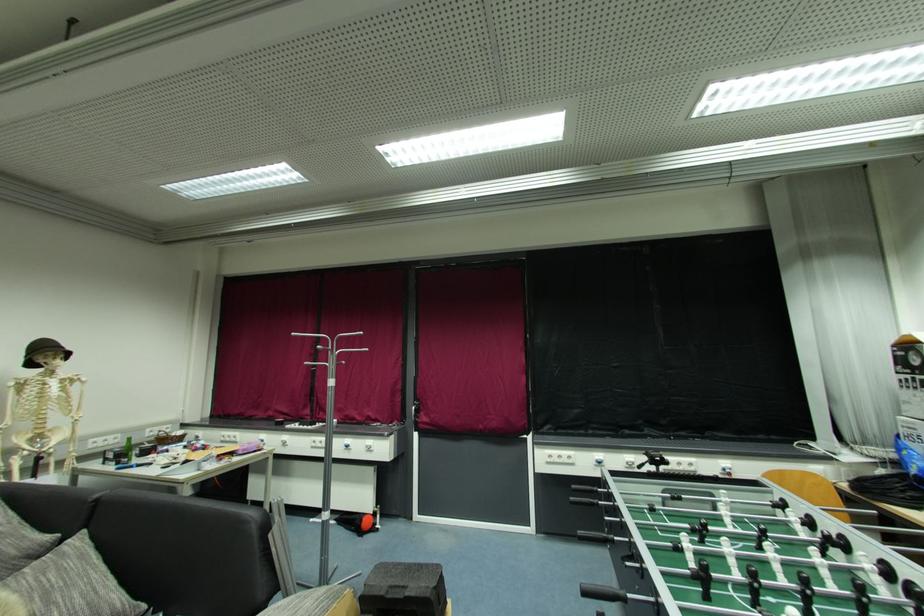
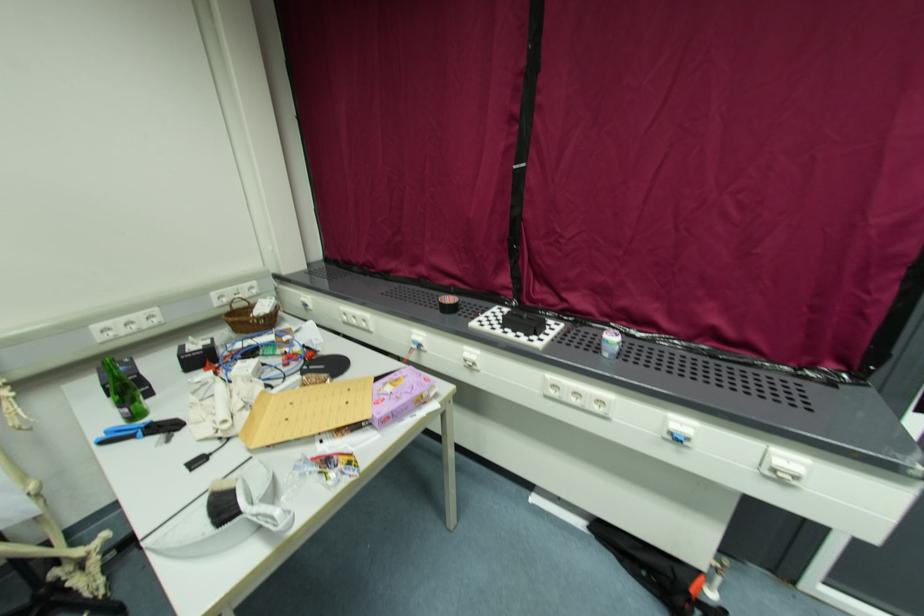
Where in the second image is the point corresponding to point 371,450 from the first image?

(783, 477)